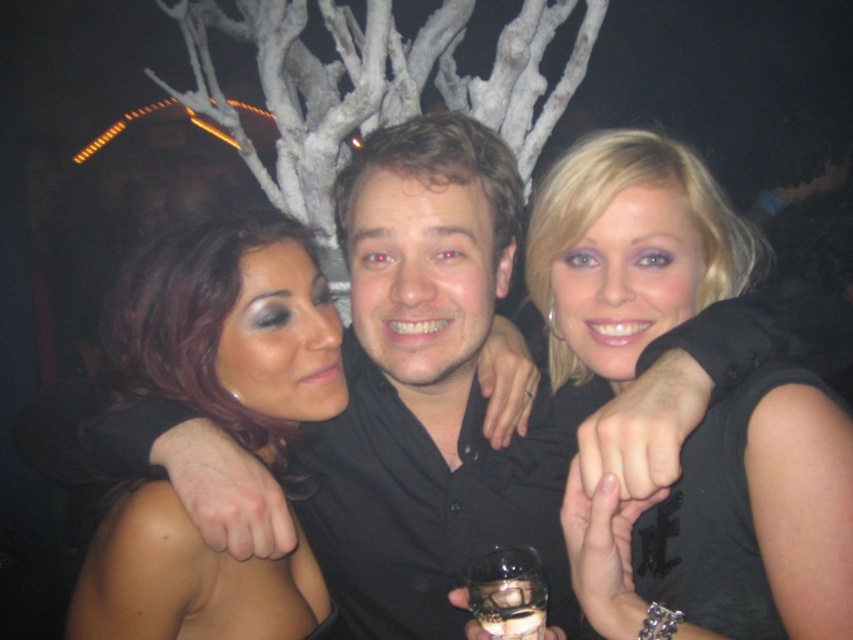
You are a photographer at the nightclub trying to capture a candid shot of the group. The black matte dress at center and the shiny dark hair at center are both in your frame. Which object should you focus on first if you want to ensure both are in focus, considering their sizes?

The black matte dress at center is taller than the shiny dark hair at center, so focusing on the larger object, the black matte dress at center, would help ensure both are in focus.

In the scene shown: You are a photographer at the nightclub trying to capture a closeup of the black matte dress at center and the shiny dark hair at center. Since you can only focus on one object at a time, which one should you choose to ensure it fills more of the frame?

The black matte dress at center is bigger than the shiny dark hair at center, so you should focus on the black matte dress at center to ensure it fills more of the frame.

You are a photographer at the nightclub and want to capture a clear photo of both the black matte dress at center and the shiny dark hair at center. Since the camera can only focus on one subject at a time, which one should you focus on to ensure the other is still somewhat in focus?

The black matte dress at center is in front of shiny dark hair at center, so focusing on the black matte dress at center will keep the shiny dark hair at center somewhat in focus as it is behind.